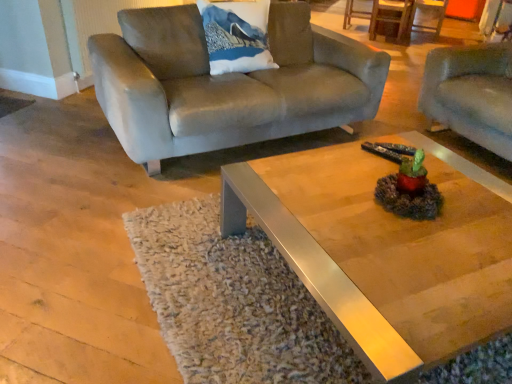
Question: Is suede couch at upper left, placed as the second studio couch when sorted from right to left, wider than suede-like gray couch at right, placed as the 1th studio couch when sorted from right to left?

Choices:
 (A) yes
 (B) no

Answer: (A)

Question: Can you confirm if suede couch at upper left, placed as the second studio couch when sorted from right to left, is taller than suede-like gray couch at right, which is the 2th studio couch from left to right?

Choices:
 (A) no
 (B) yes

Answer: (A)

Question: Is suede couch at upper left, which ranks as the first studio couch in left-to-right order, smaller than suede-like gray couch at right, placed as the 1th studio couch when sorted from right to left?

Choices:
 (A) yes
 (B) no

Answer: (B)

Question: Is suede couch at upper left, which ranks as the first studio couch in left-to-right order, not inside suede-like gray couch at right, placed as the 1th studio couch when sorted from right to left?

Choices:
 (A) yes
 (B) no

Answer: (A)

Question: Is suede couch at upper left, placed as the second studio couch when sorted from right to left, positioned before suede-like gray couch at right, which is the 2th studio couch from left to right?

Choices:
 (A) yes
 (B) no

Answer: (A)

Question: From a real-world perspective, is suede couch at upper left, placed as the second studio couch when sorted from right to left, on suede-like gray couch at right, placed as the 1th studio couch when sorted from right to left?

Choices:
 (A) yes
 (B) no

Answer: (A)

Question: Is white fabric pillow with mountain print at upper center further to the viewer compared to suede couch at upper left, placed as the second studio couch when sorted from right to left?

Choices:
 (A) no
 (B) yes

Answer: (B)

Question: Is white fabric pillow with mountain print at upper center not inside suede couch at upper left, which ranks as the first studio couch in left-to-right order?

Choices:
 (A) yes
 (B) no

Answer: (B)

Question: Considering the relative sizes of white fabric pillow with mountain print at upper center and suede couch at upper left, placed as the second studio couch when sorted from right to left, in the image provided, is white fabric pillow with mountain print at upper center smaller than suede couch at upper left, placed as the second studio couch when sorted from right to left,?

Choices:
 (A) no
 (B) yes

Answer: (B)

Question: Considering the relative sizes of white fabric pillow with mountain print at upper center and suede couch at upper left, which ranks as the first studio couch in left-to-right order, in the image provided, is white fabric pillow with mountain print at upper center bigger than suede couch at upper left, which ranks as the first studio couch in left-to-right order,?

Choices:
 (A) no
 (B) yes

Answer: (A)

Question: Considering the relative positions of white fabric pillow with mountain print at upper center and suede couch at upper left, placed as the second studio couch when sorted from right to left, in the image provided, is white fabric pillow with mountain print at upper center to the left of suede couch at upper left, placed as the second studio couch when sorted from right to left, from the viewer's perspective?

Choices:
 (A) no
 (B) yes

Answer: (B)

Question: Is white fabric pillow with mountain print at upper center shorter than suede couch at upper left, placed as the second studio couch when sorted from right to left?

Choices:
 (A) no
 (B) yes

Answer: (B)

Question: Can you confirm if suede-like gray couch at right, placed as the 1th studio couch when sorted from right to left, is thinner than metallic polished coffee table at center?

Choices:
 (A) yes
 (B) no

Answer: (A)